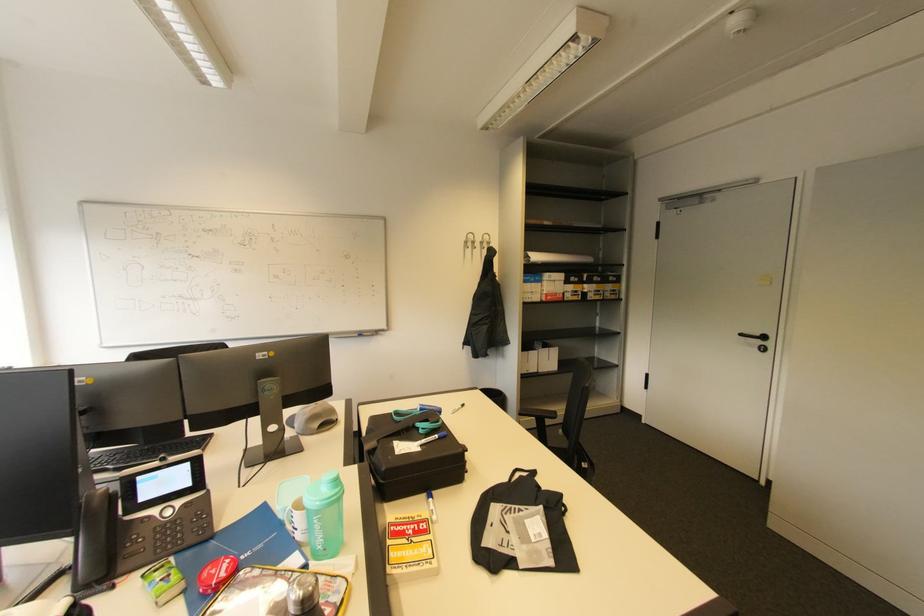
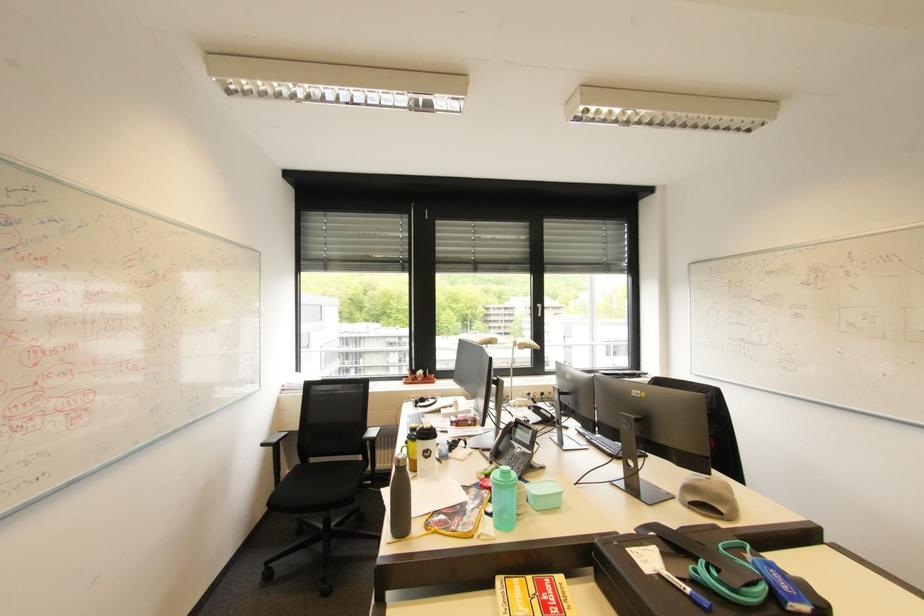
Locate, in the second image, the point that corresponds to point (420, 552) in the first image.

(526, 602)